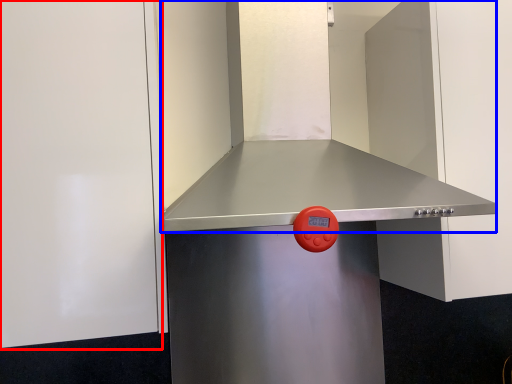
Question: Which object appears farthest to the camera in this image, door (highlighted by a red box) or vent (highlighted by a blue box)?

Choices:
 (A) door
 (B) vent

Answer: (A)